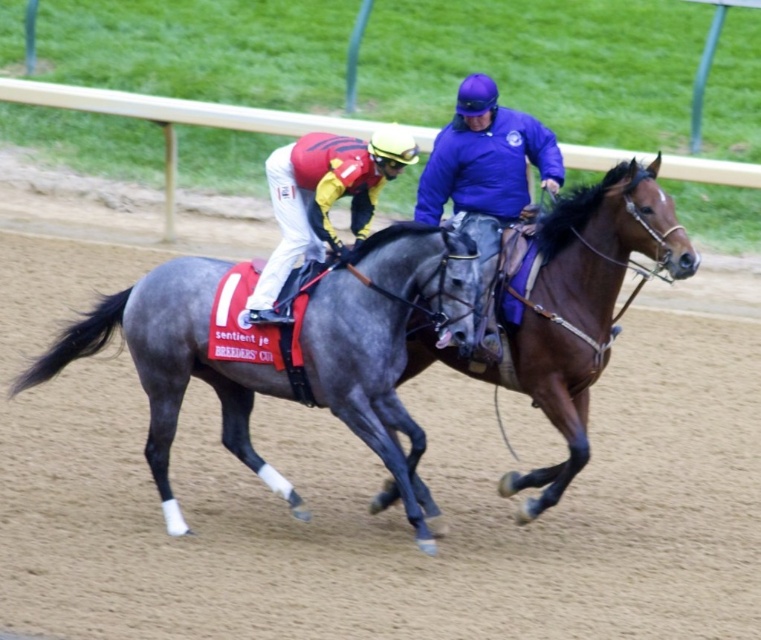
Question: In this image, where is shiny gray horse at center located relative to purple smooth jacket at center?

Choices:
 (A) above
 (B) below

Answer: (B)

Question: Which object appears closest to the camera in this image?

Choices:
 (A) matte red helmet at center
 (B) purple smooth jacket at center
 (C) shiny gray horse at center

Answer: (C)

Question: Can you confirm if shiny gray horse at center is smaller than brown glossy horse at center?

Choices:
 (A) no
 (B) yes

Answer: (A)

Question: Among these objects, which one is farthest from the camera?

Choices:
 (A) shiny gray horse at center
 (B) purple smooth jacket at center
 (C) shiny black horse at center

Answer: (B)

Question: Considering the relative positions of shiny black horse at center and matte red helmet at center in the image provided, where is shiny black horse at center located with respect to matte red helmet at center?

Choices:
 (A) below
 (B) above

Answer: (B)

Question: Which is farther from the purple smooth jacket at center?

Choices:
 (A) shiny black horse at center
 (B) brown glossy horse at center
 (C) matte red helmet at center
 (D) shiny gray horse at center

Answer: (D)